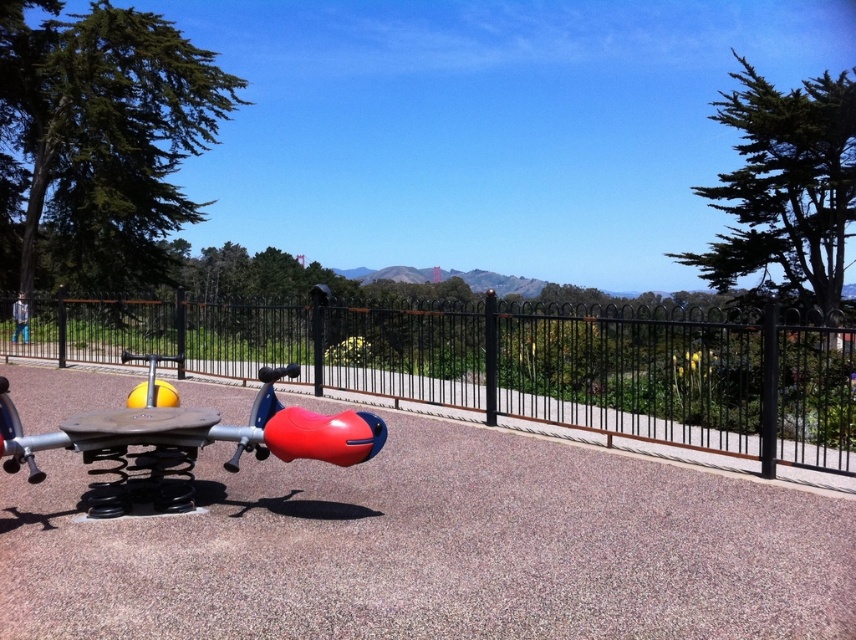
You are standing at the playground and want to take a photo of the two points mentioned. Which point is closer to the camera, point (620, 368) or point (9, 424)?

Point (9, 424) is closer to the camera because the description states that point (620, 368) is further away.

You are standing at the entrance of the playground and want to reach the black metal fence at center. According to the coordinates provided, which direction should you walk to reach it?

The black metal fence at center is located at coordinates point (506, 364), so you should walk towards the center of the playground to reach it.

You are a parent trying to ensure your child stays within the playground area. The black metal fence at center and the rubberized plastic seesaw at center are both in your line of sight. Which object is wider, potentially offering better visibility as a boundary marker?

The black metal fence at center is wider than the rubberized plastic seesaw at center, making it a better boundary marker for visibility.